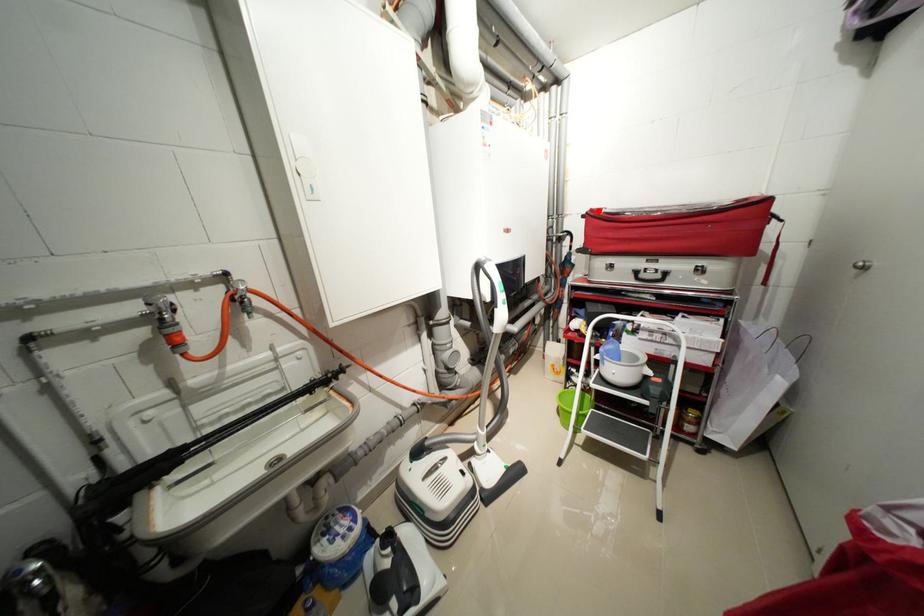
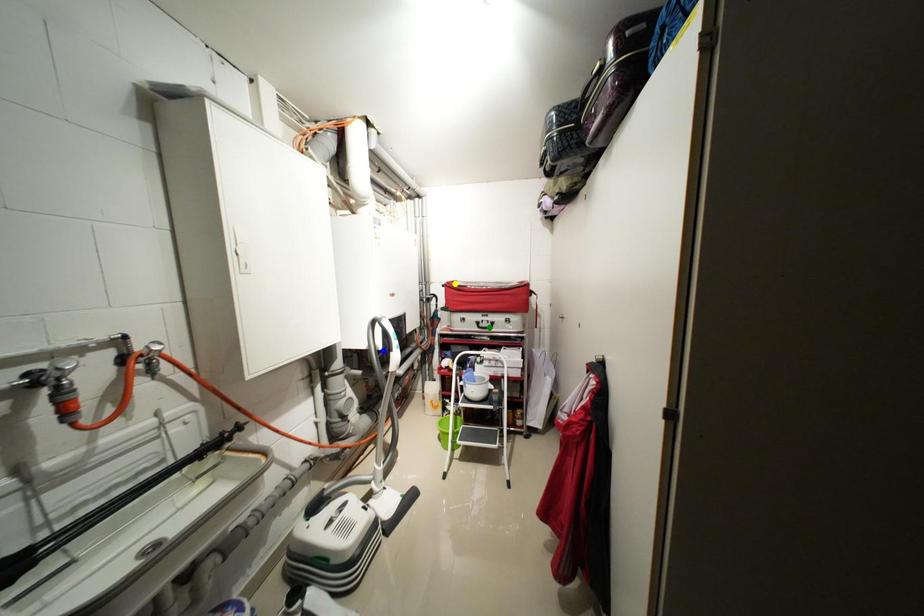
Question: I am providing you with two images of the same scene from different viewpoints. A red point is marked on the first image. You are given multiple points on the second image. In image 2, which mark is for the same physical point as the one in image 1?

Choices:
 (A) green point
 (B) yellow point
 (C) blue point

Answer: (B)